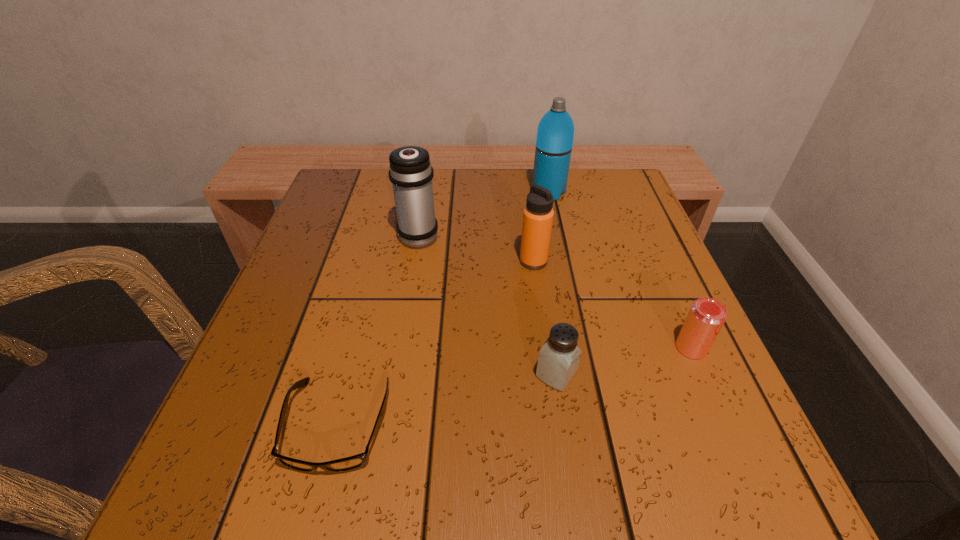
At what (x,y) coordinates should I click in order to perform the action: click on the farthest object. Please return your answer as a coordinate pair (x, y). Looking at the image, I should click on (554, 142).

Where is `the leftmost thermos bottle`? The image size is (960, 540). the leftmost thermos bottle is located at coordinates (411, 173).

Find the location of a particular element. the second farthest thermos bottle is located at coordinates click(x=411, y=173).

This screenshot has height=540, width=960. I want to click on the fourth shortest object, so click(x=538, y=215).

The image size is (960, 540). In order to click on the fourth nearest object in this screenshot , I will do `click(538, 215)`.

You are a GUI agent. You are given a task and a screenshot of the screen. Output one action in this format:
    pyautogui.click(x=<x>, y=<y>)
    Task: Click on the saltshaker
    This screenshot has height=540, width=960.
    Given the screenshot: What is the action you would take?
    pyautogui.click(x=558, y=361)

Where is `the rightmost object`? The image size is (960, 540). the rightmost object is located at coordinates (706, 316).

The width and height of the screenshot is (960, 540). I want to click on the shortest object, so click(349, 463).

Identify the location of vacant space located on the left of the farthest thermos bottle. The width and height of the screenshot is (960, 540). (380, 192).

Locate an element on the screen. Image resolution: width=960 pixels, height=540 pixels. vacant space located 0.160m on the side with the handle of the leftmost thermos bottle is located at coordinates (427, 184).